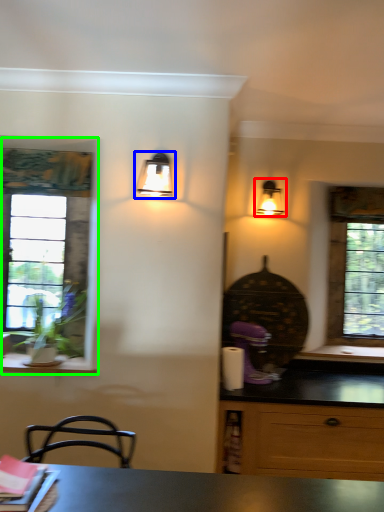
Question: Based on their relative distances, which object is farther from lamp (highlighted by a red box)? Choose from lamp (highlighted by a blue box) and window (highlighted by a green box).

Choices:
 (A) lamp
 (B) window

Answer: (B)